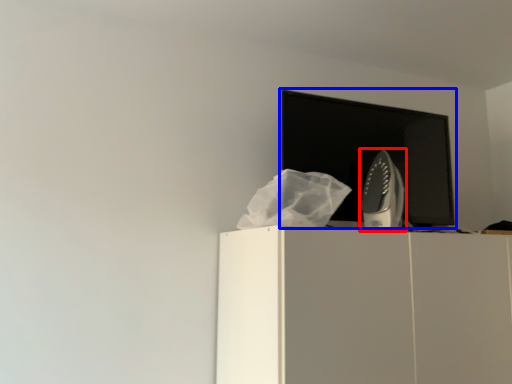
Question: Which object appears closest to the camera in this image, home appliance (highlighted by a red box) or computer monitor (highlighted by a blue box)?

Choices:
 (A) home appliance
 (B) computer monitor

Answer: (A)